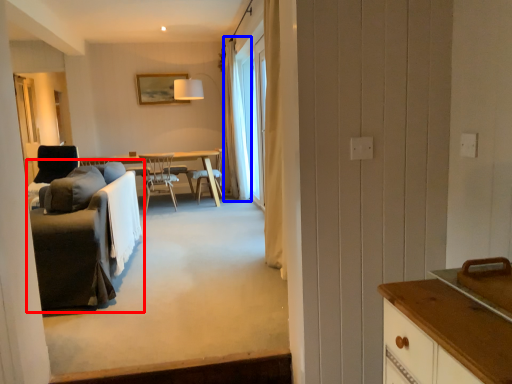
Question: Among these objects, which one is farthest to the camera, studio couch (highlighted by a red box) or curtain (highlighted by a blue box)?

Choices:
 (A) studio couch
 (B) curtain

Answer: (B)